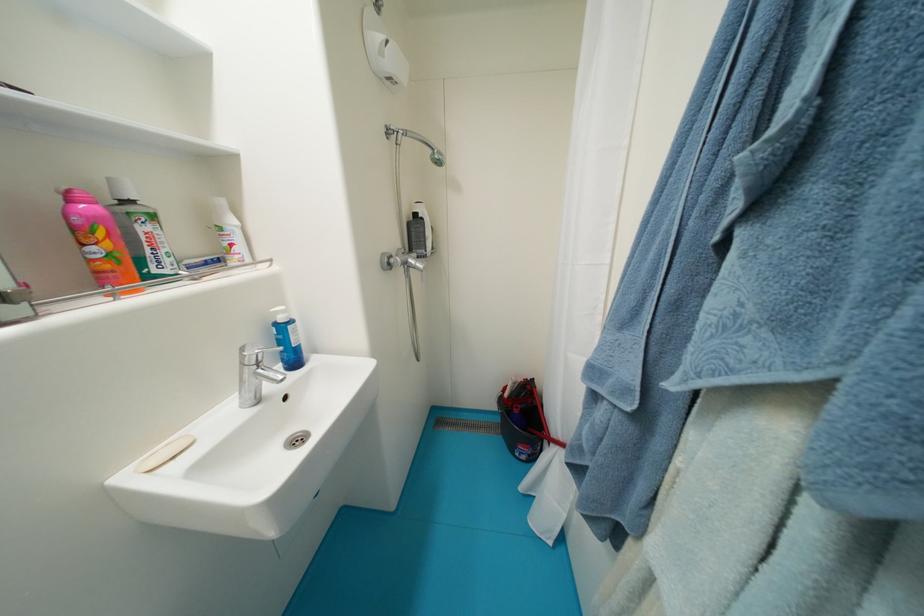
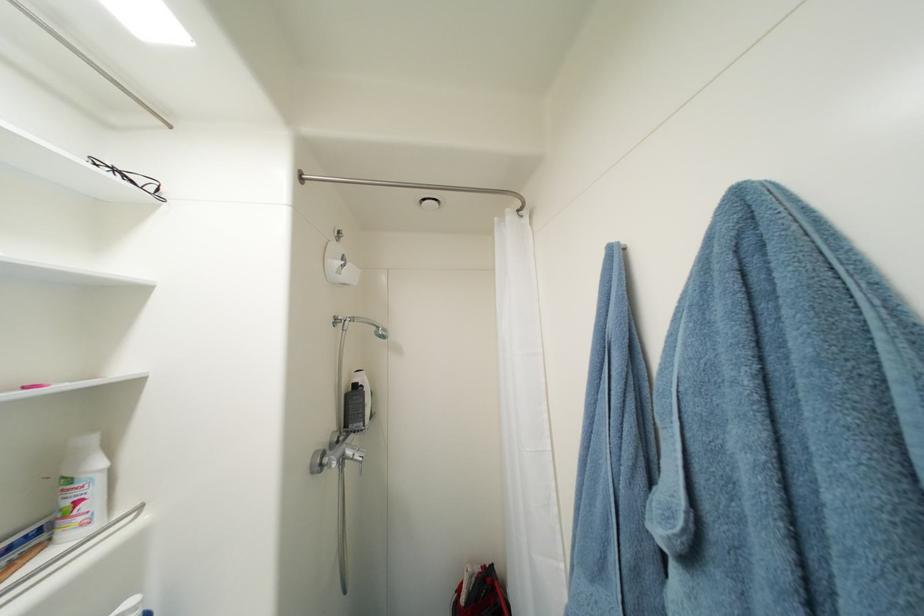
The point at [418,262] is marked in the first image. Where is the corresponding point in the second image?

(356, 454)